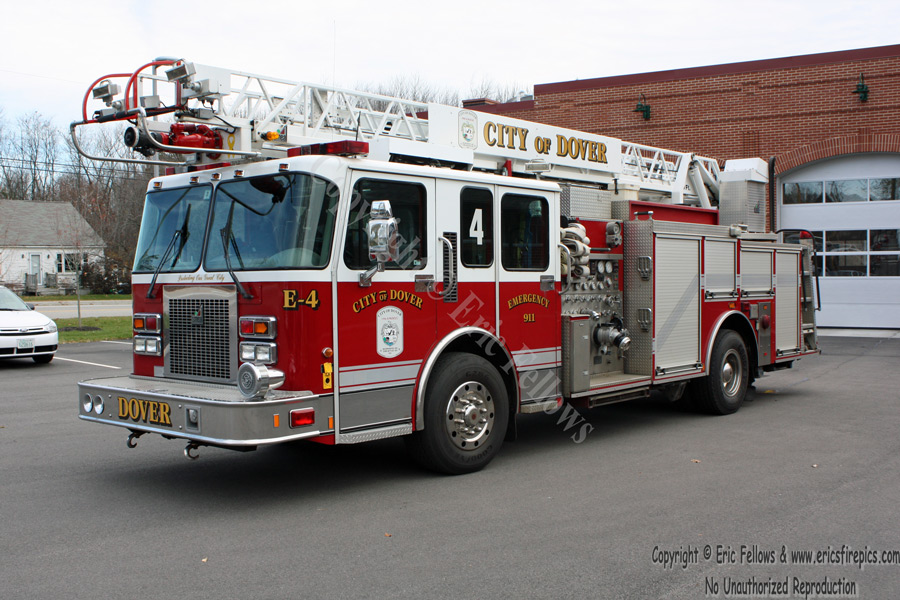
Locate an element on the screen. The image size is (900, 600). ladder is located at coordinates (348, 110).